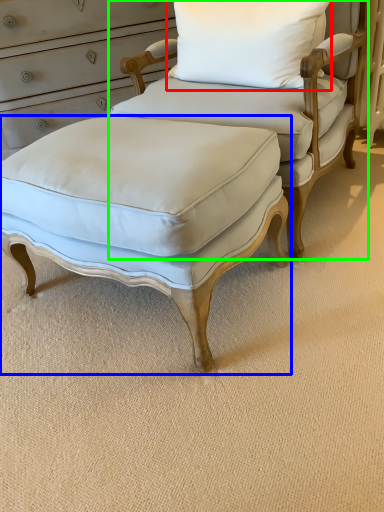
Question: Which object is the farthest from pillow (highlighted by a red box)? Choose among these: stool (highlighted by a blue box) or chair (highlighted by a green box).

Choices:
 (A) stool
 (B) chair

Answer: (A)